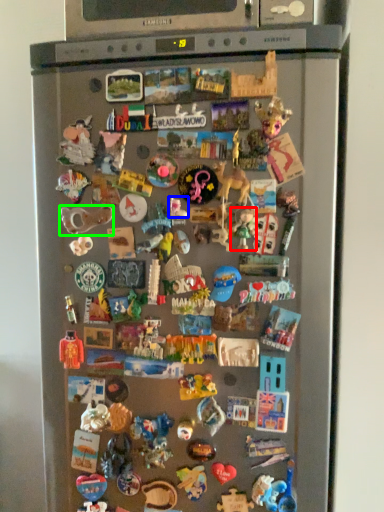
Question: Estimate the real-world distances between objects in this image. Which object is closer to toy (highlighted by a red box), toy (highlighted by a blue box) or toy (highlighted by a green box)?

Choices:
 (A) toy
 (B) toy

Answer: (A)